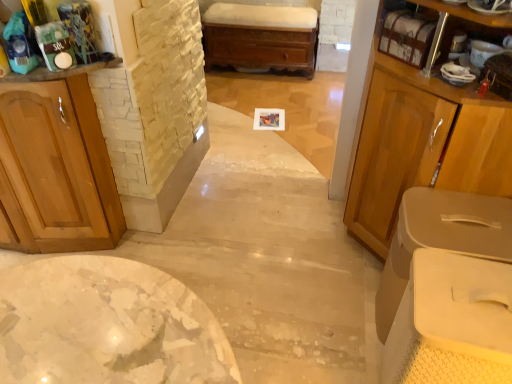
Question: From a real-world perspective, is wooden cabinet at left, which is the first cabinetry from left to right, physically above matte wood cabinet at right, positioned as the 2th cabinetry in left-to-right order?

Choices:
 (A) yes
 (B) no

Answer: (B)

Question: Is wooden cabinet at left, which is the first cabinetry from left to right, shorter than matte wood cabinet at right, the 2th cabinetry positioned from the right?

Choices:
 (A) yes
 (B) no

Answer: (A)

Question: Could matte wood cabinet at right, the 2th cabinetry positioned from the right, be considered to be inside wooden cabinet at left, arranged as the third cabinetry when viewed from the right?

Choices:
 (A) no
 (B) yes

Answer: (A)

Question: Is matte wood cabinet at right, the 2th cabinetry positioned from the right, at the back of wooden cabinet at left, which is the first cabinetry from left to right?

Choices:
 (A) yes
 (B) no

Answer: (B)

Question: Is wooden cabinet at left, which is the first cabinetry from left to right, bigger than matte wood cabinet at right, positioned as the 2th cabinetry in left-to-right order?

Choices:
 (A) no
 (B) yes

Answer: (A)

Question: From a real-world perspective, is matte wood cabinet at right, the 2th cabinetry positioned from the right, positioned above or below wooden shelf at upper right?

Choices:
 (A) below
 (B) above

Answer: (A)

Question: Is matte wood cabinet at right, positioned as the 2th cabinetry in left-to-right order, to the left or to the right of wooden shelf at upper right in the image?

Choices:
 (A) right
 (B) left

Answer: (A)

Question: Would you say matte wood cabinet at right, the 2th cabinetry positioned from the right, is inside or outside wooden shelf at upper right?

Choices:
 (A) outside
 (B) inside

Answer: (A)

Question: Is point (421, 81) closer or farther from the camera than point (403, 29)?

Choices:
 (A) closer
 (B) farther

Answer: (A)

Question: From a real-world perspective, is wooden shelf at upper right above or below wooden chest at center?

Choices:
 (A) below
 (B) above

Answer: (B)

Question: Is wooden shelf at upper right in front of or behind wooden chest at center in the image?

Choices:
 (A) behind
 (B) front

Answer: (B)

Question: From their relative heights in the image, would you say wooden shelf at upper right is taller or shorter than wooden chest at center?

Choices:
 (A) short
 (B) tall

Answer: (A)

Question: Considering the positions of point (401, 33) and point (242, 4), is point (401, 33) closer or farther from the camera than point (242, 4)?

Choices:
 (A) farther
 (B) closer

Answer: (B)

Question: Is wooden chest at center taller or shorter than wooden cabinet at left, arranged as the third cabinetry when viewed from the right?

Choices:
 (A) tall
 (B) short

Answer: (B)

Question: From a real-world perspective, is wooden chest at center physically located above or below wooden cabinet at left, arranged as the third cabinetry when viewed from the right?

Choices:
 (A) below
 (B) above

Answer: (A)